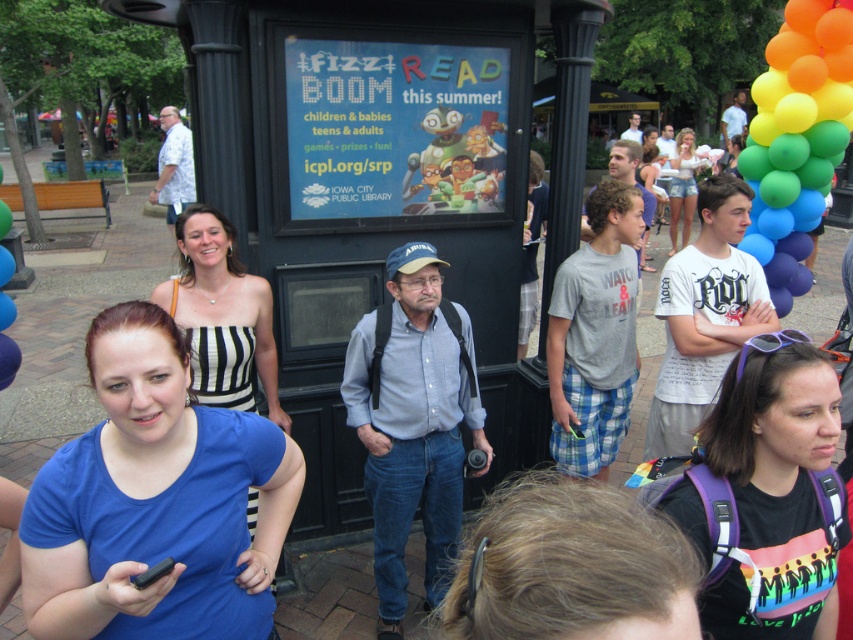
Question: Can you confirm if blue cotton shirt at center is positioned below rainbow-patterned backpack at center?

Choices:
 (A) no
 (B) yes

Answer: (B)

Question: Is rainbow balloons at right above black matte smartphone at lower left?

Choices:
 (A) no
 (B) yes

Answer: (B)

Question: Which of the following is the closest to the observer?

Choices:
 (A) striped fabric dress at center
 (B) blue cotton shirt at center
 (C) rainbow-patterned backpack at center
 (D) black matte smartphone at lower left

Answer: (D)

Question: Which object is closer to the camera taking this photo?

Choices:
 (A) black matte smartphone at lower left
 (B) denim shorts at upper right
 (C) rainbow-patterned backpack at center
 (D) striped fabric dress at center

Answer: (A)

Question: Does blue cotton shirt at center appear on the right side of denim shorts at upper right?

Choices:
 (A) yes
 (B) no

Answer: (B)

Question: Which point is farther to the camera?

Choices:
 (A) (744, 582)
 (B) (775, 140)
 (C) (273, 380)

Answer: (B)